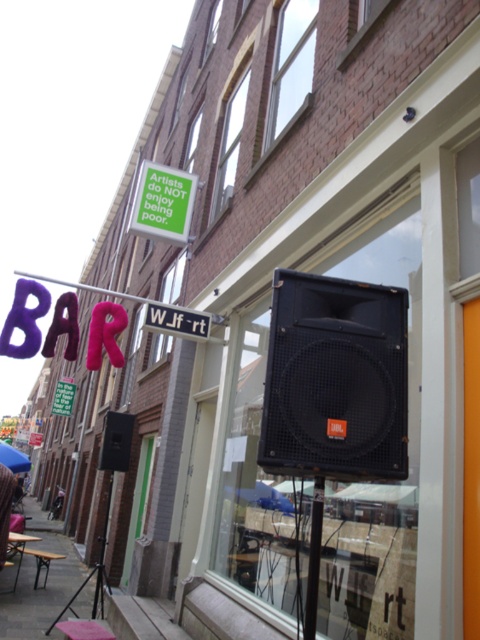
Question: Among these objects, which one is nearest to the camera?

Choices:
 (A) pink plastic table at lower left
 (B) green matte sign at upper left
 (C) black matte speaker at lower left

Answer: (A)

Question: In this image, where is pink plastic table at lower left located relative to green matte sign at upper left?

Choices:
 (A) right
 (B) left

Answer: (B)

Question: Which point is closer to the camera taking this photo?

Choices:
 (A) (162, 308)
 (B) (76, 628)
 (C) (309, 470)

Answer: (C)

Question: Is purple fabric sign at upper left smaller than green paper sign at upper left?

Choices:
 (A) yes
 (B) no

Answer: (B)

Question: Can you confirm if pink plastic table at lower left is positioned to the left of green paper sign at upper left?

Choices:
 (A) yes
 (B) no

Answer: (B)

Question: Which of the following is the farthest from the observer?

Choices:
 (A) (98, 636)
 (B) (103, 426)

Answer: (B)